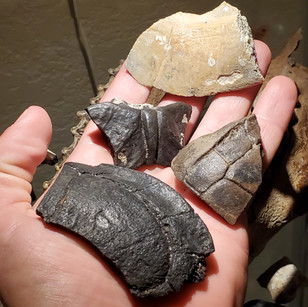
Locate an element on the screen. floor is located at coordinates (32, 44).